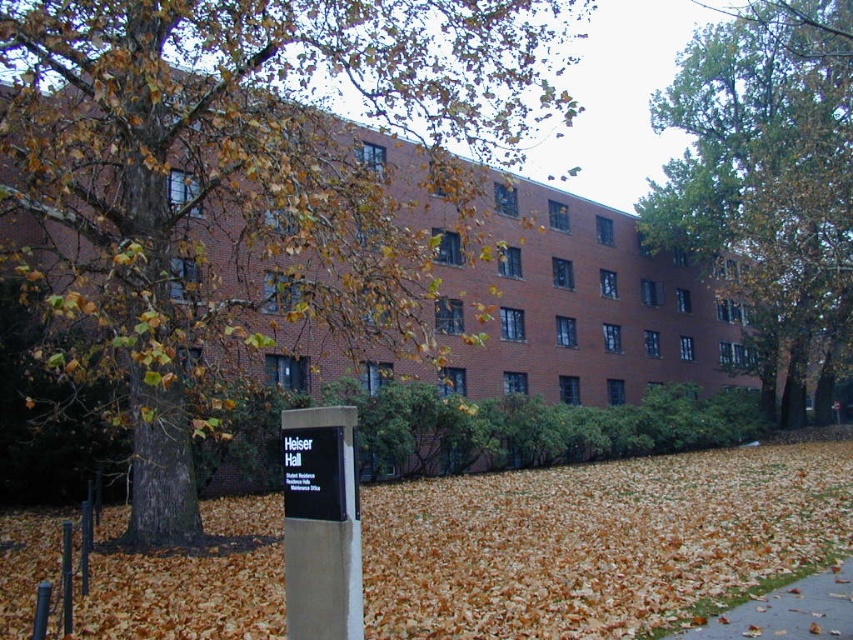
You are standing in front of Helser Hall during autumn. You notice two points marked on the image. The first point is at coordinates point [260,204] and the second point is at point [682,74]. Which point is closer to your current position?

Point [260,204] is closer to the camera than point [682,74], so the first point is closer to your current position.

You are a gardener who needs to clear the area around Helser Hall. You see the brown leaf litter at lower center and the brown asphalt pavement at lower right. Which area requires more effort to clean based on their sizes?

The brown leaf litter at lower center requires more effort to clean because it is larger in size than the brown asphalt pavement at lower right.

You are standing at the base of the tree in the left foreground of the image. You want to walk to the point labeled point (587, 602). However, there is an obstacle at point (465, 228). Can you reach your destination without passing through the obstacle?

Point (465, 228) is behind point (587, 602), so you can reach point (587, 602) without passing through the obstacle at point (465, 228) because the obstacle is behind your destination.